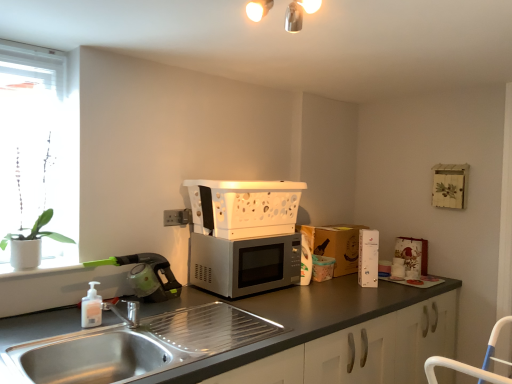
Where is `vacant area located to the right-hand side of white cardboard box at right, the first appliance positioned from the right`? This screenshot has width=512, height=384. vacant area located to the right-hand side of white cardboard box at right, the first appliance positioned from the right is located at coordinates (391, 283).